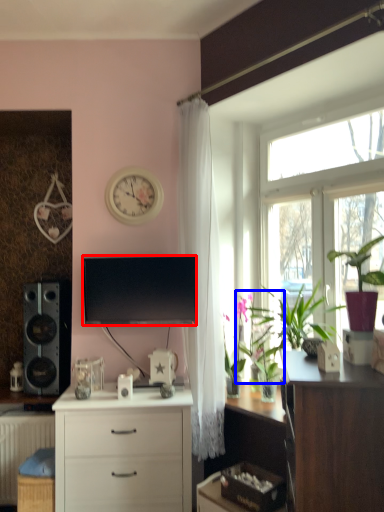
Question: Which object is closer to the camera taking this photo, television (highlighted by a red box) or plant (highlighted by a blue box)?

Choices:
 (A) television
 (B) plant

Answer: (B)